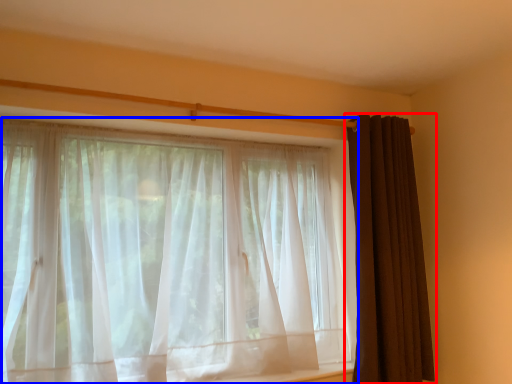
Question: Among these objects, which one is nearest to the camera, curtain (highlighted by a red box) or curtain (highlighted by a blue box)?

Choices:
 (A) curtain
 (B) curtain

Answer: (B)